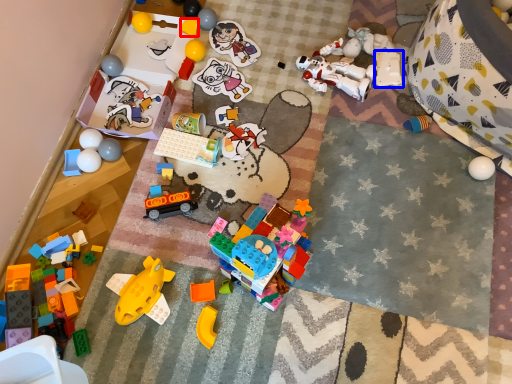
Question: Which object is closer to the camera taking this photo, toy (highlighted by a red box) or toy (highlighted by a blue box)?

Choices:
 (A) toy
 (B) toy

Answer: (B)